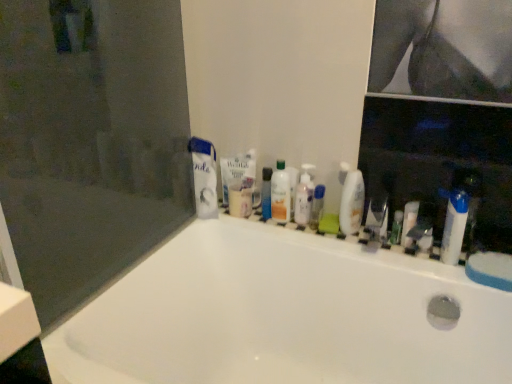
Question: Does transparent glass screen door at upper left have a greater height compared to metallic silver razor at center, which appears as the 4th toiletry when viewed from the right?

Choices:
 (A) no
 (B) yes

Answer: (B)

Question: Is transparent glass screen door at upper left to the left of metallic silver razor at center, acting as the 3th toiletry starting from the left, from the viewer's perspective?

Choices:
 (A) yes
 (B) no

Answer: (A)

Question: Is the surface of transparent glass screen door at upper left in direct contact with metallic silver razor at center, which appears as the 4th toiletry when viewed from the right?

Choices:
 (A) yes
 (B) no

Answer: (B)

Question: Does transparent glass screen door at upper left turn towards metallic silver razor at center, acting as the 3th toiletry starting from the left?

Choices:
 (A) yes
 (B) no

Answer: (A)

Question: Does transparent glass screen door at upper left appear on the right side of metallic silver razor at center, acting as the 3th toiletry starting from the left?

Choices:
 (A) no
 (B) yes

Answer: (A)

Question: Looking at the image, does white plastic tube at right, which is the first toiletry from right to left, seem bigger or smaller compared to white matte toothpaste at upper center, which is counted as the first toothpaste, starting from the right?

Choices:
 (A) small
 (B) big

Answer: (B)

Question: Is point (463, 201) positioned closer to the camera than point (245, 167)?

Choices:
 (A) closer
 (B) farther

Answer: (A)

Question: From their relative heights in the image, would you say white plastic tube at right, which is the 6th toiletry in left-to-right order, is taller or shorter than white matte toothpaste at upper center, which ranks as the 2th toothpaste in left-to-right order?

Choices:
 (A) tall
 (B) short

Answer: (B)

Question: From a real-world perspective, is white plastic tube at right, which is the first toiletry from right to left, above or below white matte toothpaste at upper center, which is counted as the first toothpaste, starting from the right?

Choices:
 (A) below
 (B) above

Answer: (A)

Question: In terms of height, does white glossy ledge at upper center look taller or shorter compared to transparent glass screen door at upper left?

Choices:
 (A) short
 (B) tall

Answer: (A)

Question: Is white glossy ledge at upper center in front of or behind transparent glass screen door at upper left in the image?

Choices:
 (A) front
 (B) behind

Answer: (B)

Question: Considering the positions of white glossy ledge at upper center and transparent glass screen door at upper left in the image, is white glossy ledge at upper center wider or thinner than transparent glass screen door at upper left?

Choices:
 (A) thin
 (B) wide

Answer: (B)

Question: Based on their sizes in the image, would you say white glossy ledge at upper center is bigger or smaller than transparent glass screen door at upper left?

Choices:
 (A) small
 (B) big

Answer: (A)

Question: From a real-world perspective, is white glossy bathtub at center positioned above or below white glossy mouthwash at center, which is the 1th mouthwash in right-to-left order?

Choices:
 (A) below
 (B) above

Answer: (A)

Question: In terms of width, does white glossy bathtub at center look wider or thinner when compared to white glossy mouthwash at center, which is the 1th mouthwash in right-to-left order?

Choices:
 (A) thin
 (B) wide

Answer: (B)